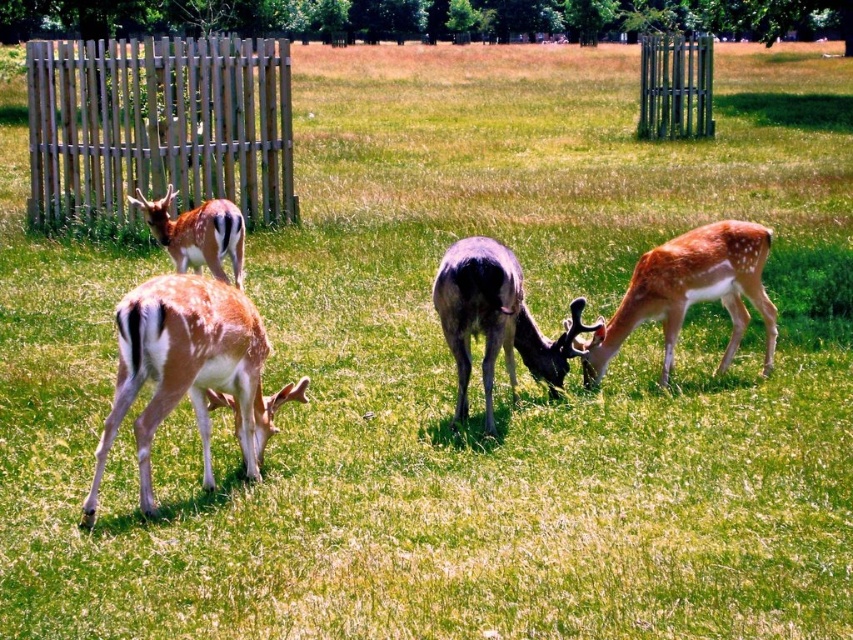
You are standing at the point labeled point (128, 358) in the image. You want to throw a small pebble to reach the edge of the field, which is 10 meters away from you. Can you estimate whether the pebble will land beyond the edge of the field?

The distance between you and the edge of the field is 10 meters, but the pebble can only travel 5 meters from point (128, 358). Therefore, the pebble will not reach the edge of the field.

You are standing in the grassy field and want to approach the fawn fur deer at lower left. Based on its position, which direction should you move to reach it?

The fawn fur deer at lower left is located at point 0.580 on the x and 0.223 on the y, so you should move towards the lower left direction to reach it.